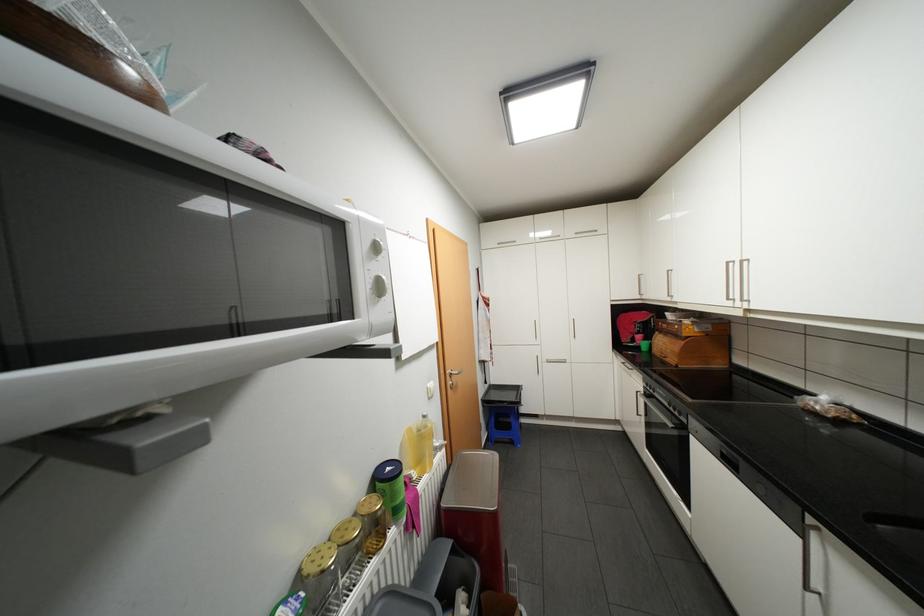
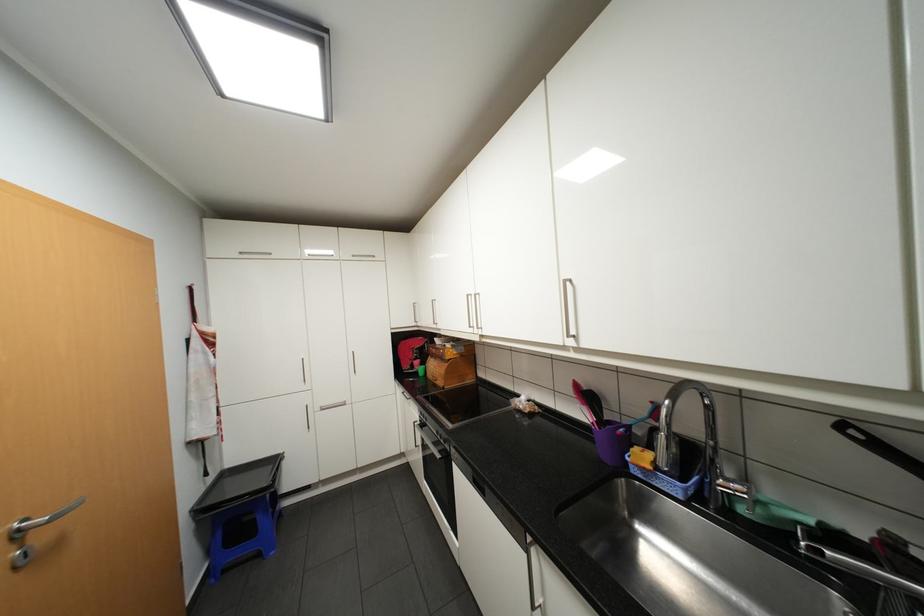
In the second image, find the point that corresponds to (667,331) in the first image.

(440, 355)